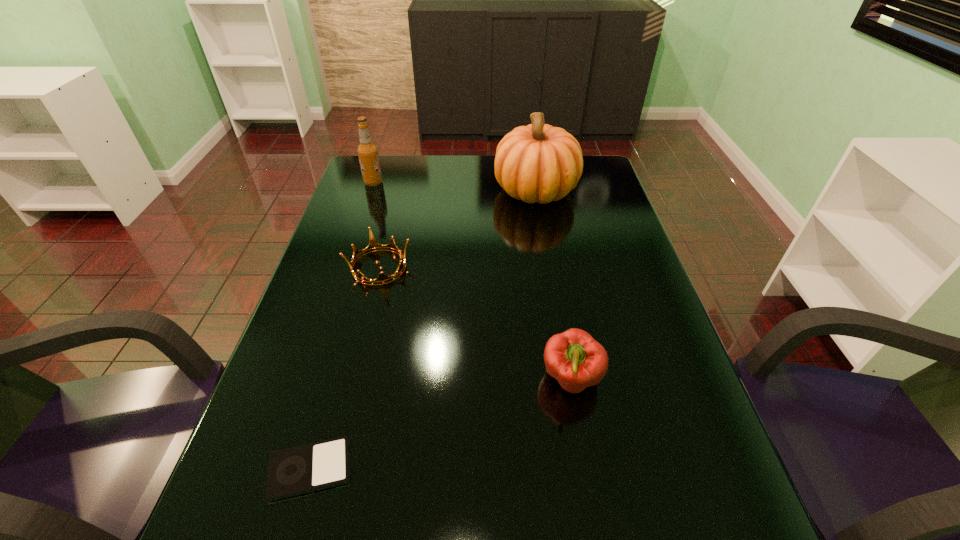
You are a GUI agent. You are given a task and a screenshot of the screen. Output one action in this format:
    pyautogui.click(x=<x>, y=<y>)
    Task: Click on the vacant space positioned 0.140m on the left of the fourth farthest object
    
    Given the screenshot: What is the action you would take?
    pyautogui.click(x=474, y=380)

I want to click on vacant space positioned 0.310m on the back of the crown, so point(398,188).

I want to click on free space located on the back of the iPod, so click(351, 323).

The height and width of the screenshot is (540, 960). I want to click on pumpkin that is at the far edge, so click(540, 163).

You are a GUI agent. You are given a task and a screenshot of the screen. Output one action in this format:
    pyautogui.click(x=<x>, y=<y>)
    Task: Click on the beer bottle situated at the far edge
    The image size is (960, 540).
    Given the screenshot: What is the action you would take?
    pyautogui.click(x=367, y=151)

Where is `beer bottle at the left edge`? beer bottle at the left edge is located at coordinates (367, 151).

Where is `crown present at the left edge`? The height and width of the screenshot is (540, 960). crown present at the left edge is located at coordinates (373, 245).

Find the location of a particular element. This screenshot has height=540, width=960. iPod situated at the left edge is located at coordinates (298, 470).

Where is `object that is at the right edge`? The image size is (960, 540). object that is at the right edge is located at coordinates (540, 163).

Where is `object located in the far left corner section of the desktop`? object located in the far left corner section of the desktop is located at coordinates (367, 151).